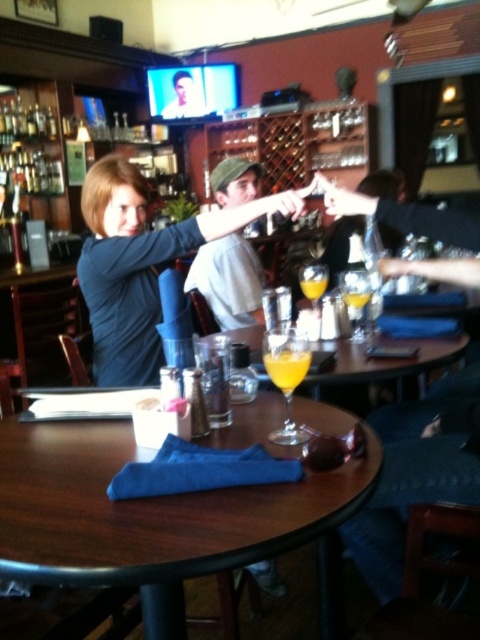
You are a waiter carrying a tray of drinks. You need to place a new drink on the table where the matte blue shirt at center and orange liquid glass at table center are located. The tray is 24 inches wide. Can you safely place the tray between them without spilling any drinks?

The distance between the matte blue shirt at center and orange liquid glass at table center is 25.78 inches. Since the tray is 24 inches wide, there is enough space to safely place it between them without spilling.